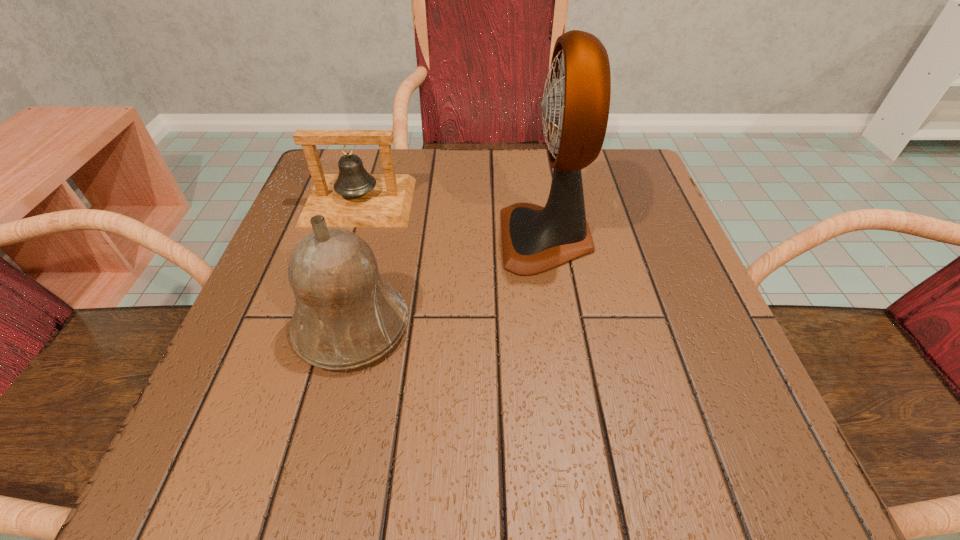
I want to click on vacant space at the far right corner, so click(647, 183).

In the image, there is a desktop. Where is `free space at the near right corner`? The image size is (960, 540). free space at the near right corner is located at coordinates (669, 421).

The height and width of the screenshot is (540, 960). I want to click on free space that is in between the rightmost object and the shorter bell, so click(453, 220).

I want to click on vacant area between the shorter bell and the tallest object, so click(453, 220).

Image resolution: width=960 pixels, height=540 pixels. I want to click on free area in between the fan and the farther bell, so click(x=453, y=220).

This screenshot has width=960, height=540. What are the coordinates of `vacant point located between the shortest object and the tallest object` in the screenshot? It's located at (453, 220).

Identify the location of empty space between the shorter bell and the fan. This screenshot has height=540, width=960. (453, 220).

The width and height of the screenshot is (960, 540). Find the location of `blank region between the rightmost object and the farther bell`. blank region between the rightmost object and the farther bell is located at coordinates pyautogui.click(x=453, y=220).

I want to click on object that ranks as the closest to the fan, so click(347, 315).

Identify which object is the closest to the second shortest object. Please provide its 2D coordinates. Your answer should be formatted as a tuple, i.e. [(x, y)], where the tuple contains the x and y coordinates of a point satisfying the conditions above.

[(353, 198)]